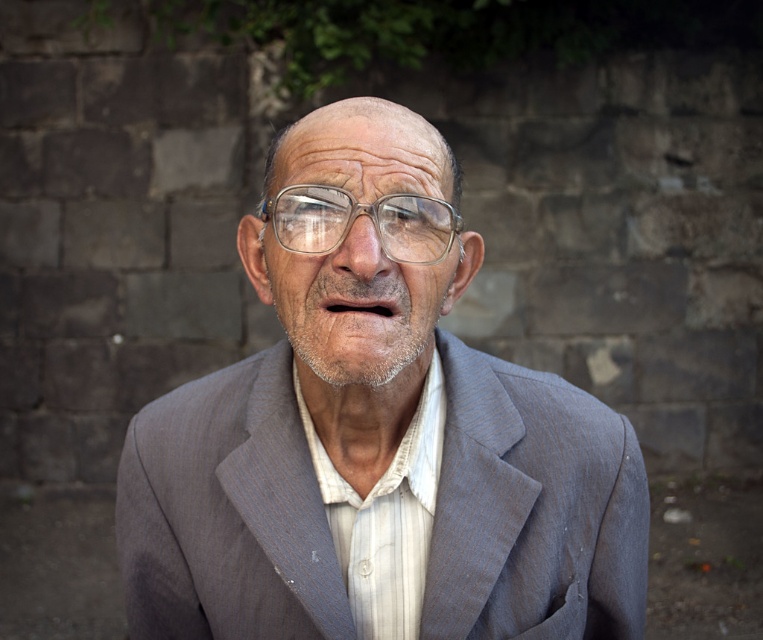
Is gray textured suit at center further to camera compared to transparent plastic glasses at center?

No, it is not.

Can you confirm if gray textured suit at center is thinner than transparent plastic glasses at center?

No, gray textured suit at center is not thinner than transparent plastic glasses at center.

Which is in front, point (575, 502) or point (340, 218)?

Point (340, 218)

You are a GUI agent. You are given a task and a screenshot of the screen. Output one action in this format:
    pyautogui.click(x=<x>, y=<y>)
    Task: Click on the gray textured suit at center
    The image size is (763, 640).
    Given the screenshot: What is the action you would take?
    pyautogui.click(x=375, y=435)